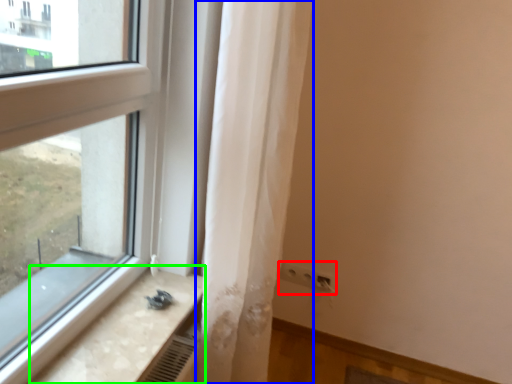
Question: Considering the real-world distances, which object is farthest from electric outlet (highlighted by a red box)? curtain (highlighted by a blue box) or counter top (highlighted by a green box)?

Choices:
 (A) curtain
 (B) counter top

Answer: (B)